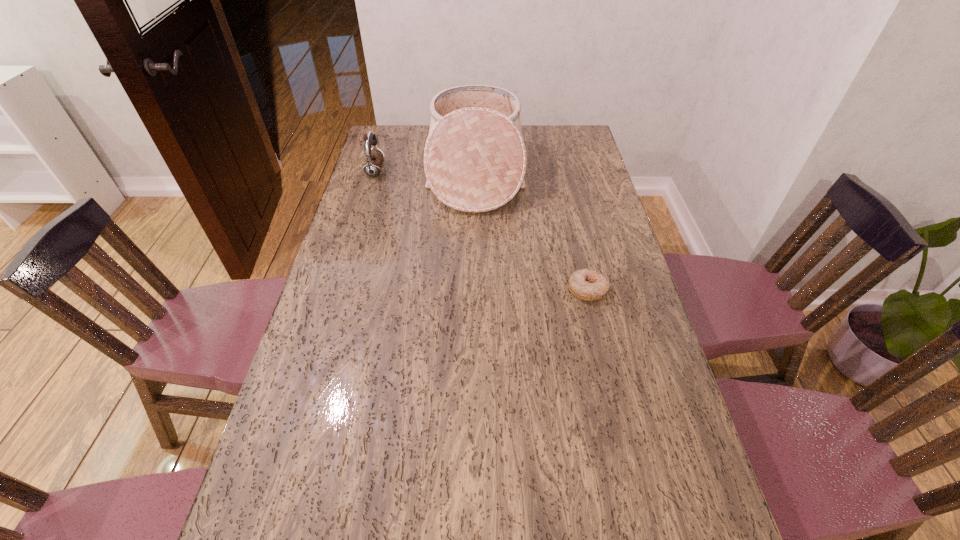
The width and height of the screenshot is (960, 540). I want to click on vacant point that satisfies the following two spatial constraints: 1. on the ear pads of the earphone; 2. on the back side of the rightmost object, so point(340,289).

The image size is (960, 540). I want to click on free space that satisfies the following two spatial constraints: 1. with the lid open on the second object from left to right; 2. on the left side of the nearest object, so click(x=474, y=289).

The height and width of the screenshot is (540, 960). Find the location of `blank space that satisfies the following two spatial constraints: 1. with the lid open on the nearest object; 2. on the left side of the tallest object`. blank space that satisfies the following two spatial constraints: 1. with the lid open on the nearest object; 2. on the left side of the tallest object is located at coordinates (474, 289).

Image resolution: width=960 pixels, height=540 pixels. I want to click on free location that satisfies the following two spatial constraints: 1. on the ear pads of the shortest object; 2. on the right side of the second tallest object, so click(340, 289).